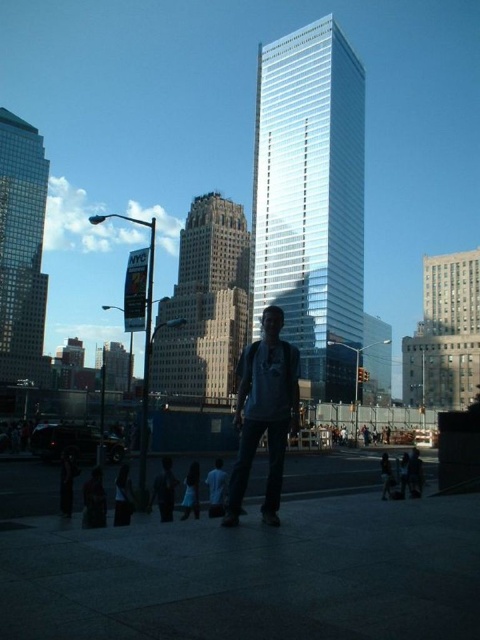
You are standing on the sidewalk in the foreground and want to take a photo of the glassy silver skyscraper at center and the gray concrete building at right. Which building should you point your camera towards first to capture both in the same frame?

You should point your camera towards the glassy silver skyscraper at center first because it is located above the gray concrete building at right, so adjusting the angle to include both would require framing from the higher structure downwards.

From the picture: You are a photographer standing in the foreground of the scene. You want to take a photo that includes both the glassy silver skyscraper at center and the gray concrete building at right. Based on their positions, which building should you frame first in your camera viewfinder to ensure both are in the shot?

The glassy silver skyscraper at center is to the left of the gray concrete building at right, so you should frame the glassy silver skyscraper at center first to ensure both are included in the shot.